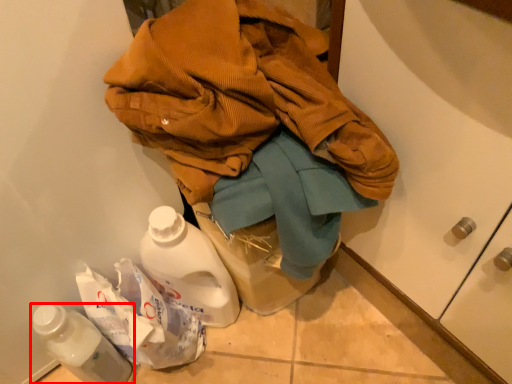
Question: Observing the image, what is the correct spatial positioning of bottle (annotated by the red box) in reference to jacket?

Choices:
 (A) left
 (B) right

Answer: (A)